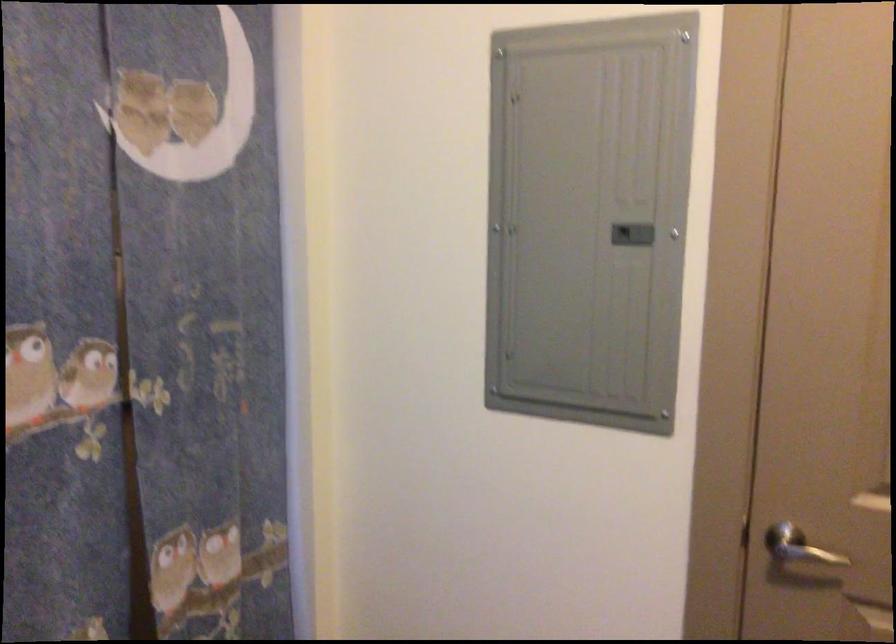
This screenshot has height=644, width=896. Identify the location of fuse box latch. click(632, 234).